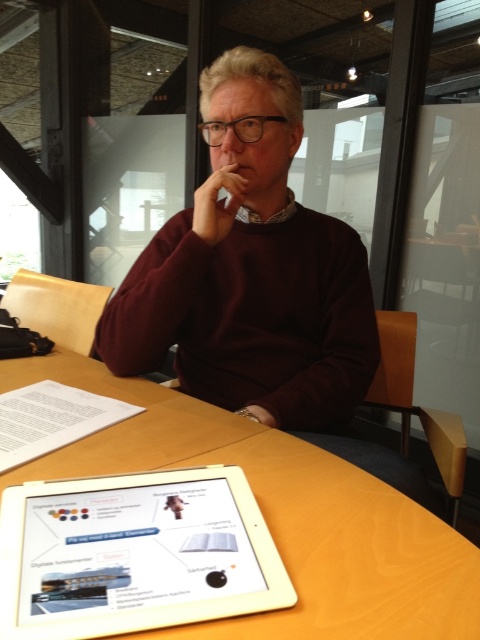
Question: Can you confirm if maroon sweater at center is positioned to the left of wooden table at center?

Choices:
 (A) yes
 (B) no

Answer: (B)

Question: Which of the following is the closest to the observer?

Choices:
 (A) maroon sweater at center
 (B) white glossy tablet at center
 (C) wooden table at center

Answer: (B)

Question: Does wooden table at center have a smaller size compared to white glossy tablet at center?

Choices:
 (A) no
 (B) yes

Answer: (A)

Question: Which object is the closest to the maroon sweater at center?

Choices:
 (A) white glossy tablet at center
 (B) wooden table at center

Answer: (B)

Question: Is maroon sweater at center below wooden table at center?

Choices:
 (A) yes
 (B) no

Answer: (B)

Question: Which is nearer to the maroon sweater at center?

Choices:
 (A) wooden table at center
 (B) white glossy tablet at center

Answer: (A)